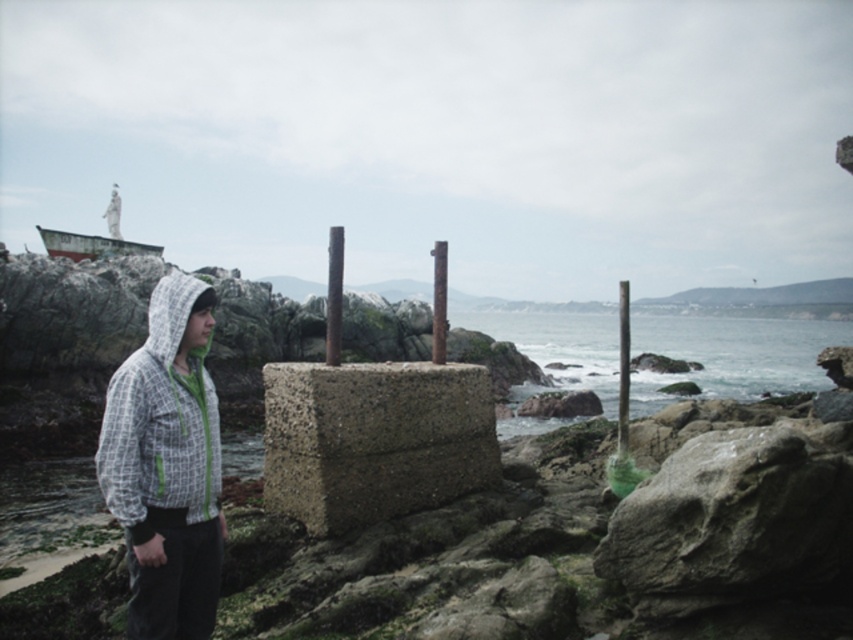
You are a photographer trying to capture the gray rough rock at lower right in your shot. Based on its coordinates, where should you position your camera to ensure it is centered in the frame?

The gray rough rock at lower right is located at coordinates point (734, 520), so you should position your camera to center the rock at that point to capture it properly.

You are a photographer trying to capture the gray rough rock at lower right and the white checkered hoodie at left in the same frame. Based on their positions, which object is closer to the camera?

The gray rough rock at lower right is closer to the camera because the white checkered hoodie at left is behind it.

You are standing on the rocky terrain near the ocean and see two points marked in the scene. One is at point (338, 268) and the other at point (628, 342). Which point is closer to you?

Point (338, 268) is closer to the viewer than point 0.537, 0.737.